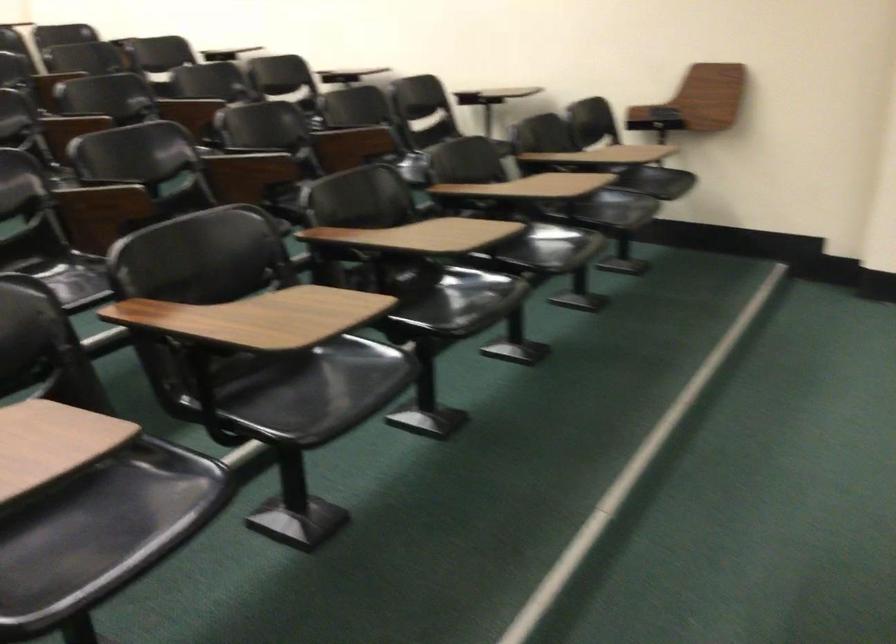
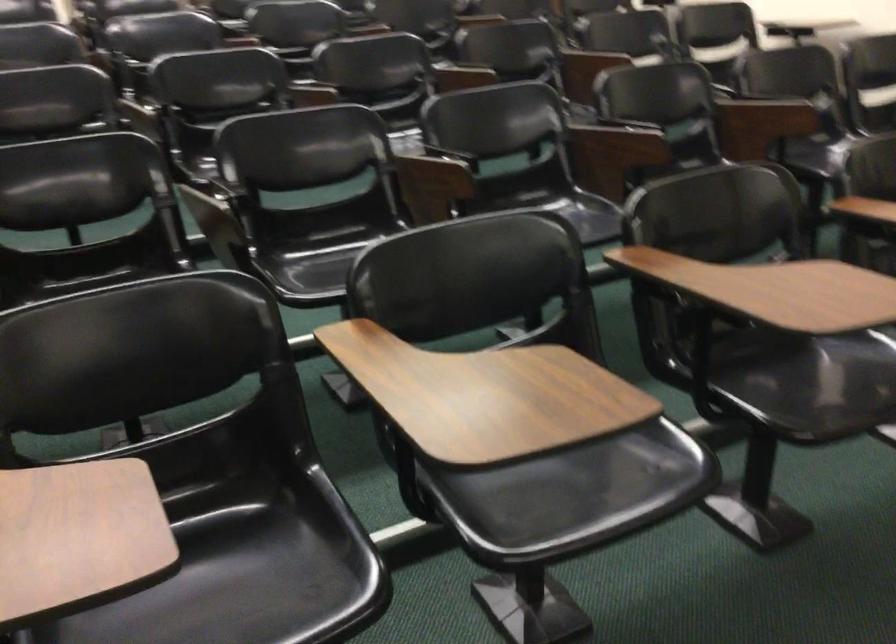
Question: The first image is from the beginning of the video and the second image is from the end. How did the camera likely rotate when shooting the video?

Choices:
 (A) Left
 (B) Right
 (C) Up
 (D) Down

Answer: (A)